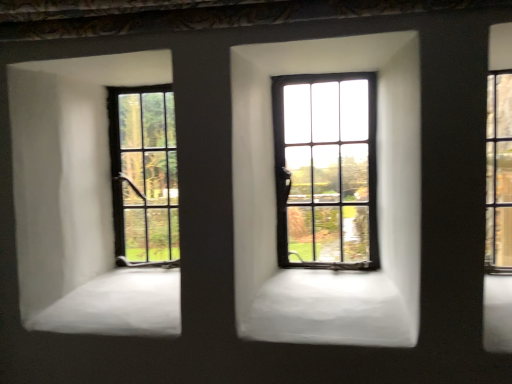
Question: Does matte black window at left, which ranks as the third window in right-to-left order, turn towards matte black window at center, the 2th window viewed from the left?

Choices:
 (A) yes
 (B) no

Answer: (B)

Question: Does matte black window at left, the first window when ordered from left to right, have a lesser width compared to matte black window at center, the 2th window viewed from the left?

Choices:
 (A) no
 (B) yes

Answer: (B)

Question: Can you confirm if matte black window at left, which ranks as the third window in right-to-left order, is positioned to the left of matte black window at center, which appears as the second window when viewed from the right?

Choices:
 (A) yes
 (B) no

Answer: (A)

Question: Could matte black window at center, the 2th window viewed from the left, be considered to be inside matte black window at left, which ranks as the third window in right-to-left order?

Choices:
 (A) yes
 (B) no

Answer: (B)

Question: Considering the relative sizes of matte black window at left, the first window when ordered from left to right, and matte black window at center, the 2th window viewed from the left, in the image provided, is matte black window at left, the first window when ordered from left to right, shorter than matte black window at center, the 2th window viewed from the left,?

Choices:
 (A) no
 (B) yes

Answer: (B)

Question: From the image's perspective, is matte black window at left, which ranks as the third window in right-to-left order, located above matte black window at center, which appears as the second window when viewed from the right?

Choices:
 (A) no
 (B) yes

Answer: (A)

Question: Is clear glass window at right, which appears as the first window when viewed from the right, thinner than matte black window at center, which appears as the second window when viewed from the right?

Choices:
 (A) yes
 (B) no

Answer: (A)

Question: Is matte black window at center, the 2th window viewed from the left, completely or partially inside clear glass window at right, which appears as the first window when viewed from the right?

Choices:
 (A) yes
 (B) no

Answer: (B)

Question: Is the depth of clear glass window at right, which appears as the first window when viewed from the right, greater than that of matte black window at center, which appears as the second window when viewed from the right?

Choices:
 (A) no
 (B) yes

Answer: (A)

Question: Is clear glass window at right, which appears as the first window when viewed from the right, shorter than matte black window at center, which appears as the second window when viewed from the right?

Choices:
 (A) no
 (B) yes

Answer: (B)

Question: Is matte black window at center, the 2th window viewed from the left, at the back of clear glass window at right, which appears as the first window when viewed from the right?

Choices:
 (A) yes
 (B) no

Answer: (B)

Question: From the image's perspective, is clear glass window at right, which appears as the first window when viewed from the right, located above matte black window at center, which appears as the second window when viewed from the right?

Choices:
 (A) no
 (B) yes

Answer: (B)

Question: Can you confirm if clear glass window at right, which appears as the first window when viewed from the right, is wider than matte black window at left, which ranks as the third window in right-to-left order?

Choices:
 (A) yes
 (B) no

Answer: (B)